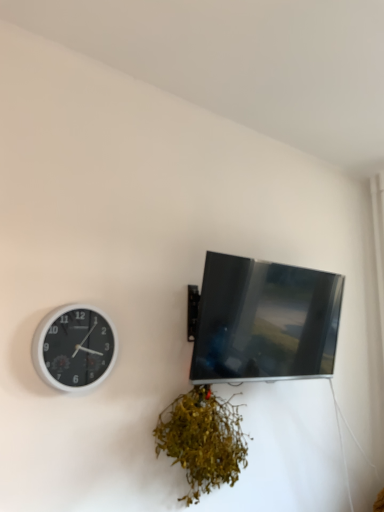
Question: From the image's perspective, is matte black tv at upper right beneath white plastic wall clock at left?

Choices:
 (A) no
 (B) yes

Answer: (A)

Question: Would you say matte black tv at upper right contains white plastic wall clock at left?

Choices:
 (A) no
 (B) yes

Answer: (A)

Question: Can you confirm if matte black tv at upper right is taller than white plastic wall clock at left?

Choices:
 (A) yes
 (B) no

Answer: (A)

Question: Is matte black tv at upper right touching white plastic wall clock at left?

Choices:
 (A) yes
 (B) no

Answer: (B)

Question: Is matte black tv at upper right thinner than white plastic wall clock at left?

Choices:
 (A) yes
 (B) no

Answer: (B)

Question: From their relative heights in the image, would you say white plastic wall clock at left is taller or shorter than matte black tv at upper right?

Choices:
 (A) tall
 (B) short

Answer: (B)

Question: From a real-world perspective, is white plastic wall clock at left physically located above or below matte black tv at upper right?

Choices:
 (A) below
 (B) above

Answer: (A)

Question: Is white plastic wall clock at left bigger or smaller than matte black tv at upper right?

Choices:
 (A) big
 (B) small

Answer: (B)

Question: Is white plastic wall clock at left inside the boundaries of matte black tv at upper right, or outside?

Choices:
 (A) inside
 (B) outside

Answer: (B)

Question: Is matte black tv at upper right bigger or smaller than white plastic wall clock at left?

Choices:
 (A) big
 (B) small

Answer: (A)

Question: From a real-world perspective, is matte black tv at upper right positioned above or below white plastic wall clock at left?

Choices:
 (A) above
 (B) below

Answer: (A)

Question: Does point (261, 376) appear closer or farther from the camera than point (52, 336)?

Choices:
 (A) farther
 (B) closer

Answer: (A)

Question: In terms of height, does matte black tv at upper right look taller or shorter compared to white plastic wall clock at left?

Choices:
 (A) short
 (B) tall

Answer: (B)

Question: Is white plastic wall clock at left in front of or behind green leafy plant at lower center in the image?

Choices:
 (A) front
 (B) behind

Answer: (A)

Question: Would you say white plastic wall clock at left is to the left or to the right of green leafy plant at lower center in the picture?

Choices:
 (A) left
 (B) right

Answer: (A)